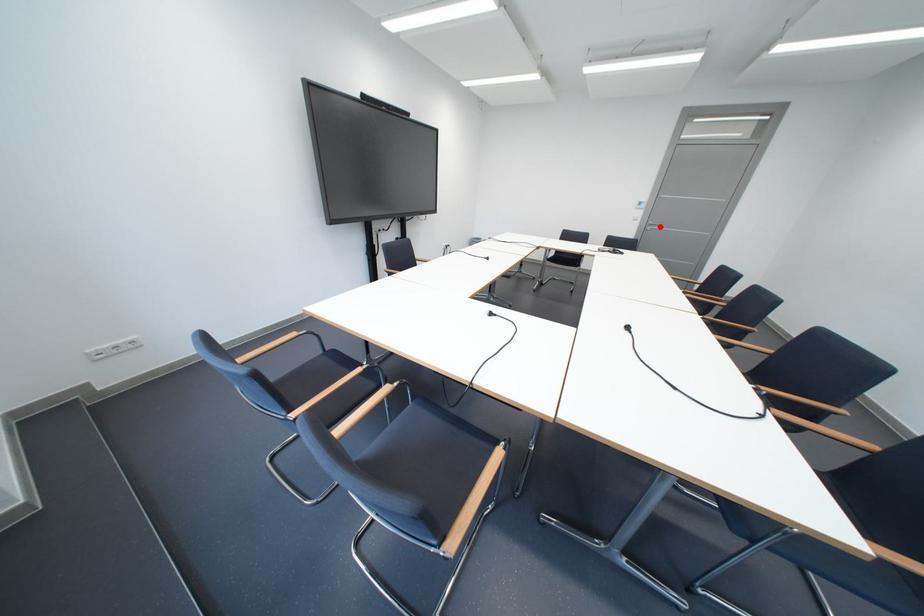
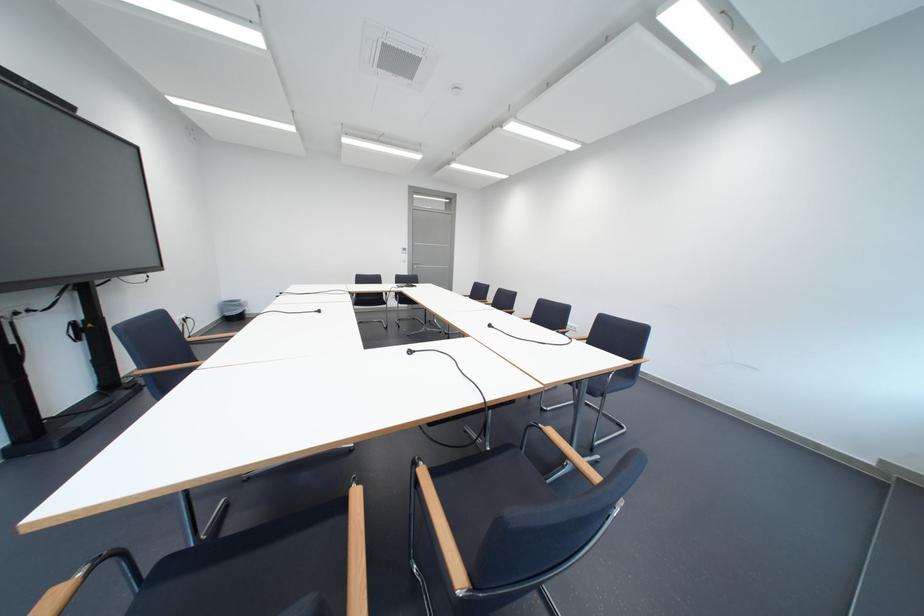
Where in the second image is the point corresponding to the highlighted location from the first image?

(426, 265)